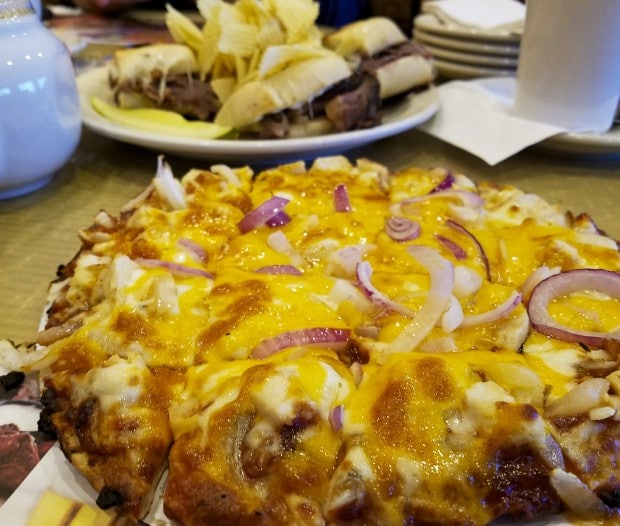
Locate an element on the screen. Image resolution: width=620 pixels, height=526 pixels. carafe is located at coordinates (6, 93).